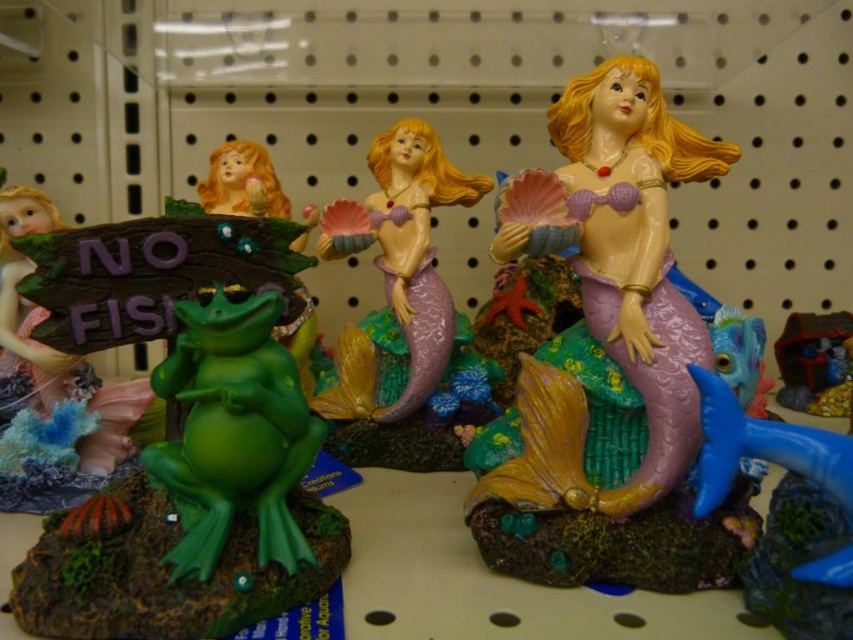
You are a customer in a store looking at the mermaid figurines. You want to buy the bigger one between the matte pink mermaid at center and the purple matte mermaid at center. Which one should you choose?

The matte pink mermaid at center is larger in size than the purple matte mermaid at center, so you should choose the matte pink mermaid at center.

You are a customer in the store and want to pick up the matte pink mermaid at center. If your hand can reach up to 30 inches, can you comfortably grab it without needing a step stool?

The matte pink mermaid at center is 28.83 inches away from the viewer, so yes, you can comfortably grab it since it is within your reach of 30 inches.

You are a store employee arranging items on a shelf. You have a matte pink mermaid at center and a matte green frog at left. If you need to place them side by side without overlapping, which one should you place first to ensure there is enough space?

The matte pink mermaid at center is wider than the matte green frog at left, so you should place the matte pink mermaid at center first to account for its larger size and ensure there is enough space for both items.